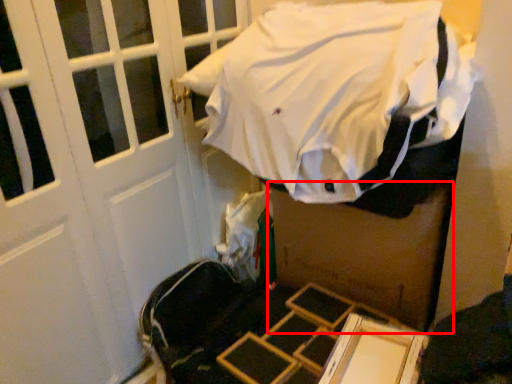
Question: Observing the image, what is the correct spatial positioning of box (annotated by the red box) in reference to sheet?

Choices:
 (A) right
 (B) left

Answer: (A)